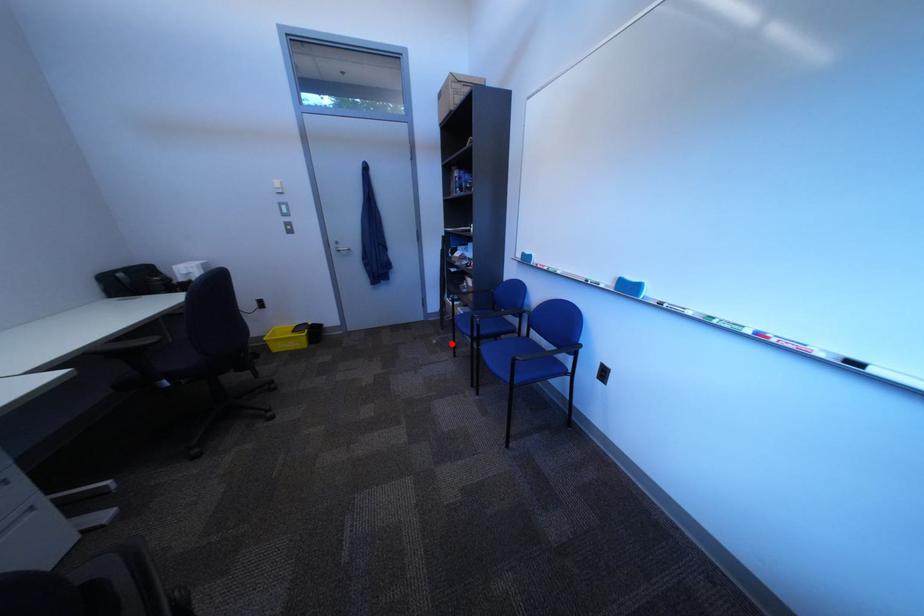
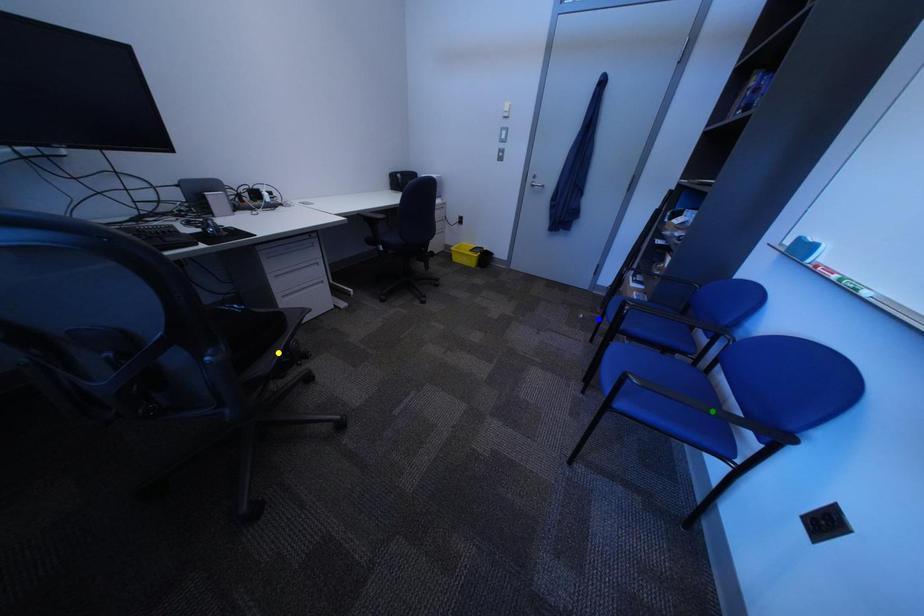
Question: I am providing you with two images of the same scene from different viewpoints. A red point is marked on the first image. You are given multiple points on the second image. Which point in image 2 represents the same 3d spot as the red point in image 1?

Choices:
 (A) green point
 (B) blue point
 (C) yellow point

Answer: (B)